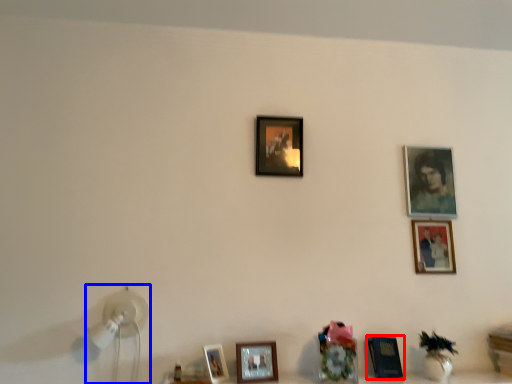
Question: Among these objects, which one is farthest to the camera, picture frame (highlighted by a red box) or table lamp (highlighted by a blue box)?

Choices:
 (A) picture frame
 (B) table lamp

Answer: (A)